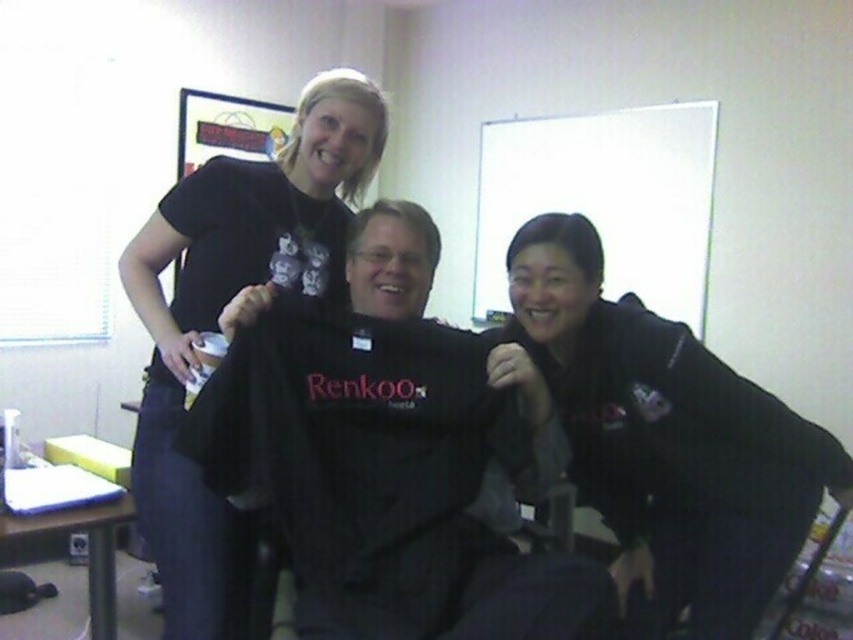
Is black fabric shirt at center below black fleece jacket at lower right?

Yes.

The image size is (853, 640). In order to click on black fabric shirt at center in this screenshot , I will do `click(392, 452)`.

Does point (589, 572) come in front of point (656, 422)?

That is True.

You are a GUI agent. You are given a task and a screenshot of the screen. Output one action in this format:
    pyautogui.click(x=<x>, y=<y>)
    Task: Click on the black fabric shirt at center
    This screenshot has width=853, height=640.
    Given the screenshot: What is the action you would take?
    tap(392, 452)